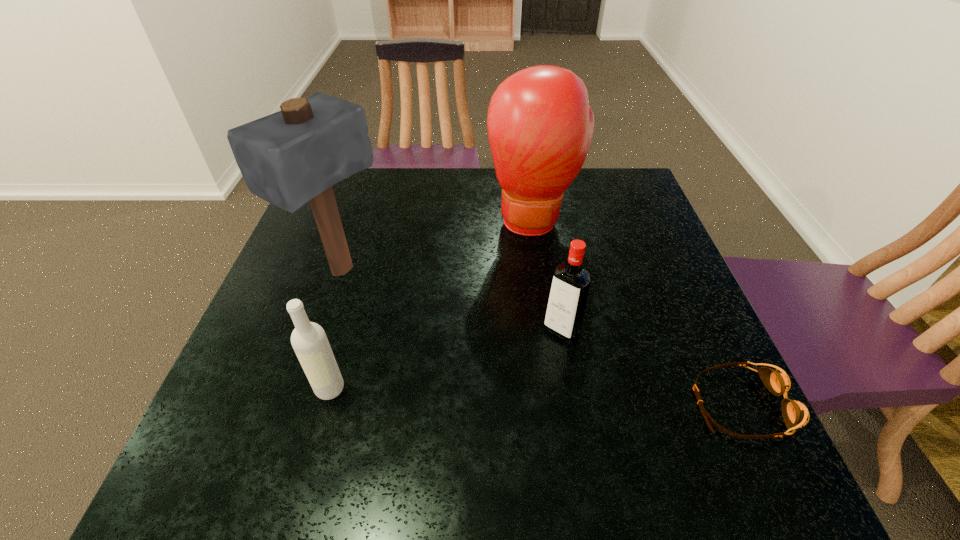
Where is `vacant area that lies between the boxing glove and the left vodka`? This screenshot has width=960, height=540. vacant area that lies between the boxing glove and the left vodka is located at coordinates (432, 304).

The height and width of the screenshot is (540, 960). What are the coordinates of `vacant area between the left vodka and the boxing glove` in the screenshot? It's located at (432, 304).

Image resolution: width=960 pixels, height=540 pixels. Find the location of `vacant point located between the mallet and the right vodka`. vacant point located between the mallet and the right vodka is located at coordinates (451, 300).

This screenshot has height=540, width=960. What are the coordinates of `vacant area between the boxing glove and the farther vodka` in the screenshot? It's located at (548, 275).

The image size is (960, 540). What are the coordinates of `empty space between the shortest object and the right vodka` in the screenshot? It's located at (652, 367).

Locate an element on the screen. vacant point located between the mallet and the left vodka is located at coordinates (335, 329).

Find the location of `unoccupied area between the boxing glove and the left vodka`. unoccupied area between the boxing glove and the left vodka is located at coordinates (432, 304).

At what (x,y) coordinates should I click in order to perform the action: click on unoccupied position between the boxing glove and the mallet. Please return your answer as a coordinate pair (x, y). The image size is (960, 540). Looking at the image, I should click on coord(438,245).

I want to click on empty space between the left vodka and the mallet, so click(x=335, y=329).

I want to click on free space that is in between the boxing glove and the right vodka, so click(548, 275).